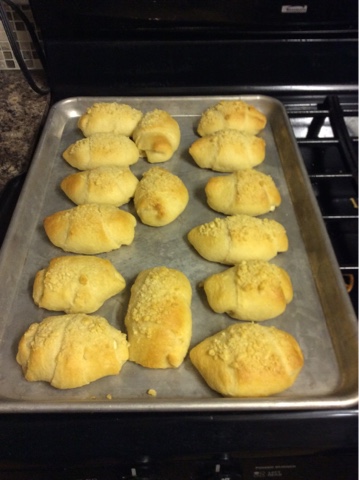
Where is `stove`? This screenshot has height=480, width=359. stove is located at coordinates pos(258,34).